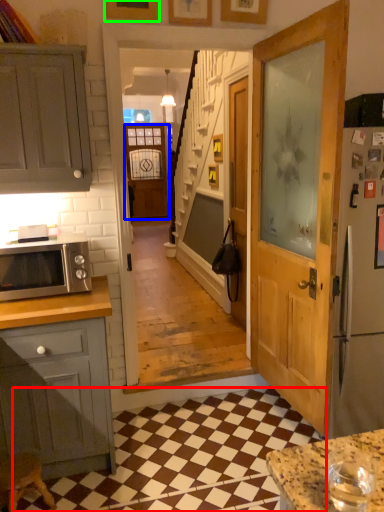
Question: Which object is the farthest from tile (highlighted by a red box)? Choose among these: screen door (highlighted by a blue box) or picture frame (highlighted by a green box).

Choices:
 (A) screen door
 (B) picture frame

Answer: (A)